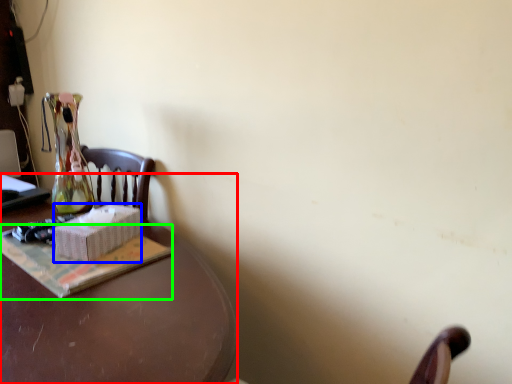
Question: Which object is the closest to the desk (highlighted by a red box)? Choose among these: box (highlighted by a blue box) or paperback book (highlighted by a green box).

Choices:
 (A) box
 (B) paperback book

Answer: (B)